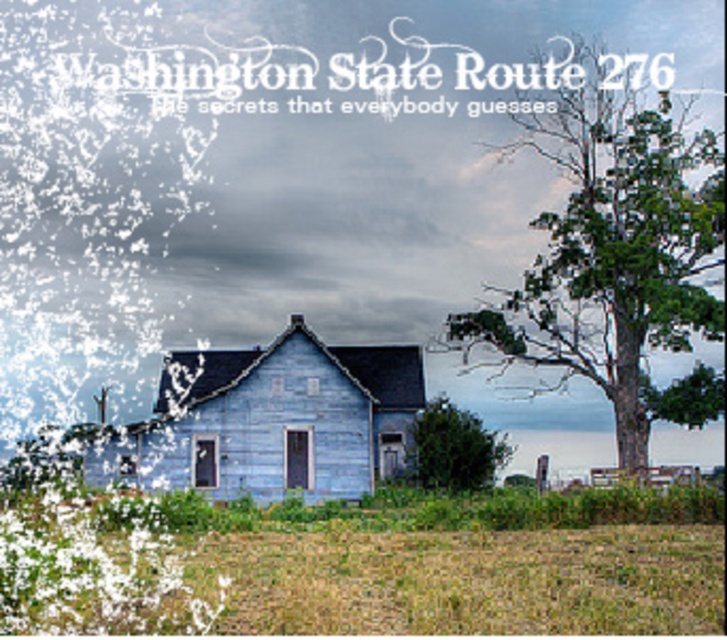
In the scene shown: You are an artist planning to paint a scene of this rural area. You have two trees in view, the green textured tree at right and the green leafy tree at center. Which tree should you focus on if you want to depict the larger tree in your painting?

The green textured tree at right is larger in size compared to the green leafy tree at center, so you should focus on the green textured tree at right for depicting the larger tree in your painting.

You are an artist painting this rural scene. You want to ensure the green textured tree at right and the green leafy tree at center are arranged correctly according to their positions in the image. Which tree should be placed higher in your painting to maintain the spatial accuracy?

The green textured tree at right should be placed higher in the painting because it is positioned over the green leafy tree at center, indicating it is closer or overlapping it in the scene.